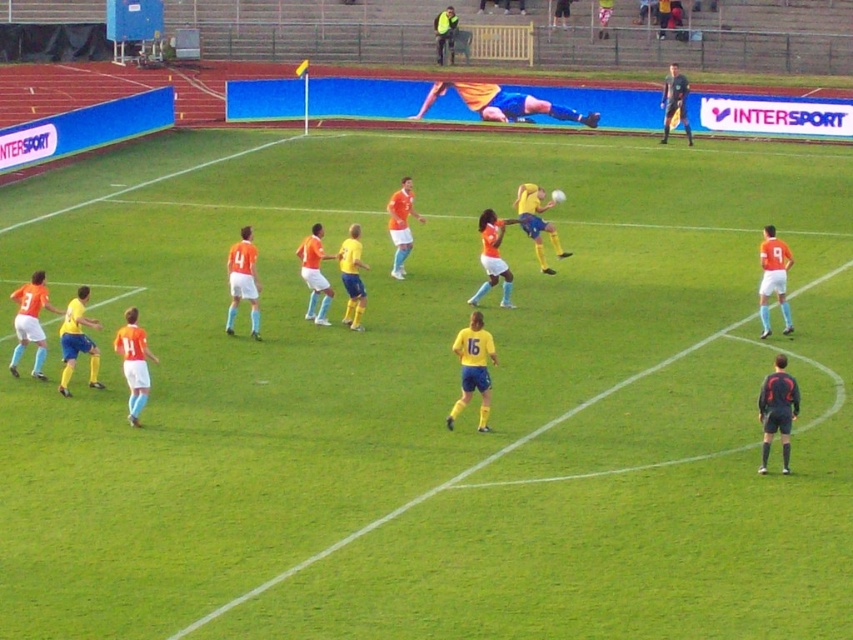
Question: Does yellow matte jersey at center have a lesser width compared to black jersey at right?

Choices:
 (A) yes
 (B) no

Answer: (B)

Question: Which object is positioned closest to the matte black shirt at upper right?

Choices:
 (A) orange matte jersey at left
 (B) yellow matte jersey at center
 (C) black jersey at right

Answer: (B)

Question: Is matte black shirt at upper right below yellow jersey at upper center?

Choices:
 (A) no
 (B) yes

Answer: (B)

Question: Can you confirm if orange matte jersey at left is smaller than yellow jersey at upper center?

Choices:
 (A) no
 (B) yes

Answer: (B)

Question: Which of these objects is positioned closest to the matte black shirt at upper right?

Choices:
 (A) black jersey at right
 (B) yellow matte jersey at center
 (C) orange matte jersey at left
 (D) yellow jersey at upper center

Answer: (D)

Question: Which object is positioned farthest from the matte black shirt at upper right?

Choices:
 (A) orange matte jersey at left
 (B) yellow matte jersey at center
 (C) black jersey at right
 (D) yellow jersey at upper center

Answer: (A)